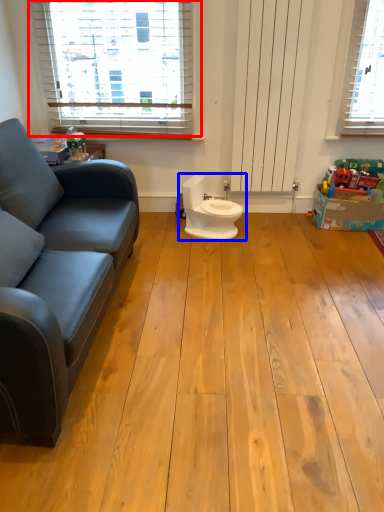
Question: Which of the following is the closest to the observer, window (highlighted by a red box) or toilet (highlighted by a blue box)?

Choices:
 (A) window
 (B) toilet

Answer: (B)